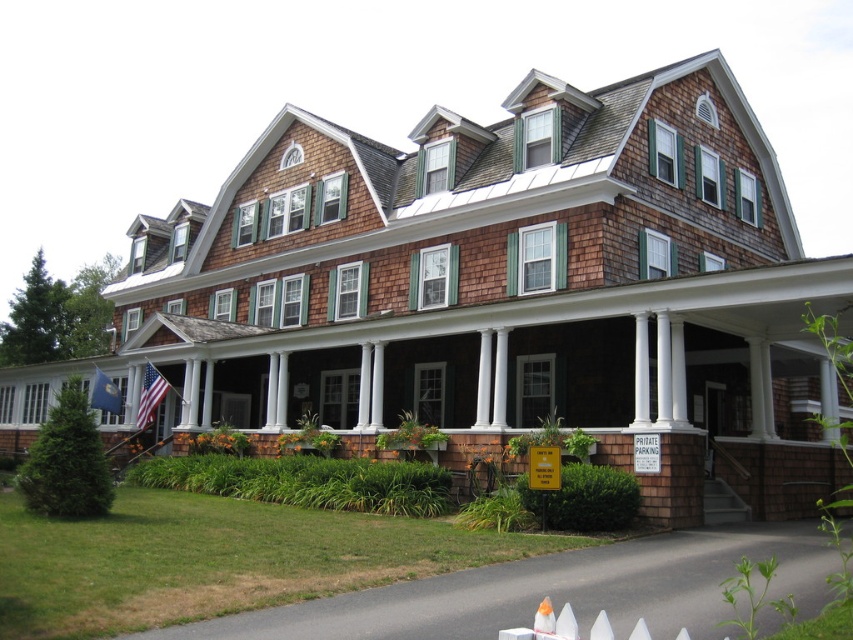
Is point (142, 390) less distant than point (119, 403)?

That is True.

Does american flag at left have a smaller size compared to blue fabric flag at lower left?

Correct, american flag at left occupies less space than blue fabric flag at lower left.

Is point (155, 388) farther from camera compared to point (113, 404)?

No, (155, 388) is in front of (113, 404).

Where is `american flag at left`? american flag at left is located at coordinates (149, 396).